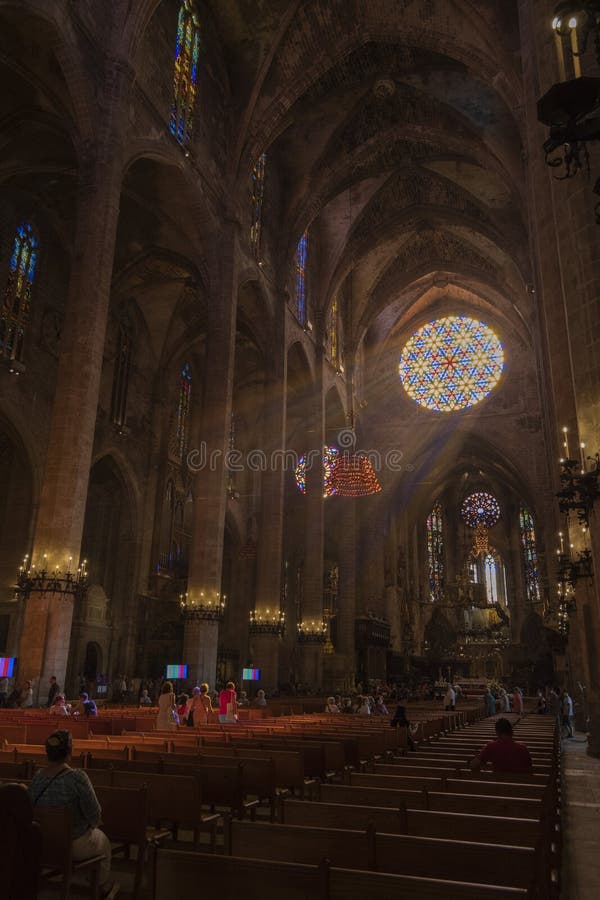
This screenshot has width=600, height=900. In order to click on candalabras on columns in this screenshot , I will do `click(53, 572)`, `click(208, 596)`, `click(269, 616)`, `click(315, 622)`.